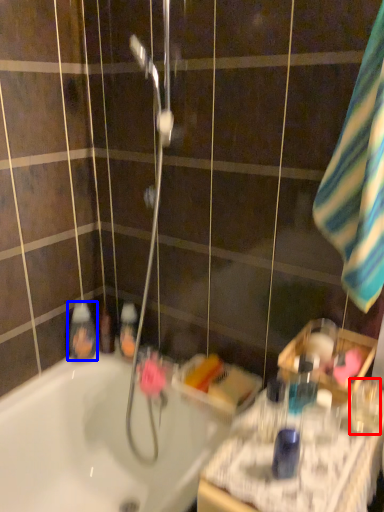
Question: Among these objects, which one is nearest to the camera, mouthwash (highlighted by a red box) or mouthwash (highlighted by a blue box)?

Choices:
 (A) mouthwash
 (B) mouthwash

Answer: (A)